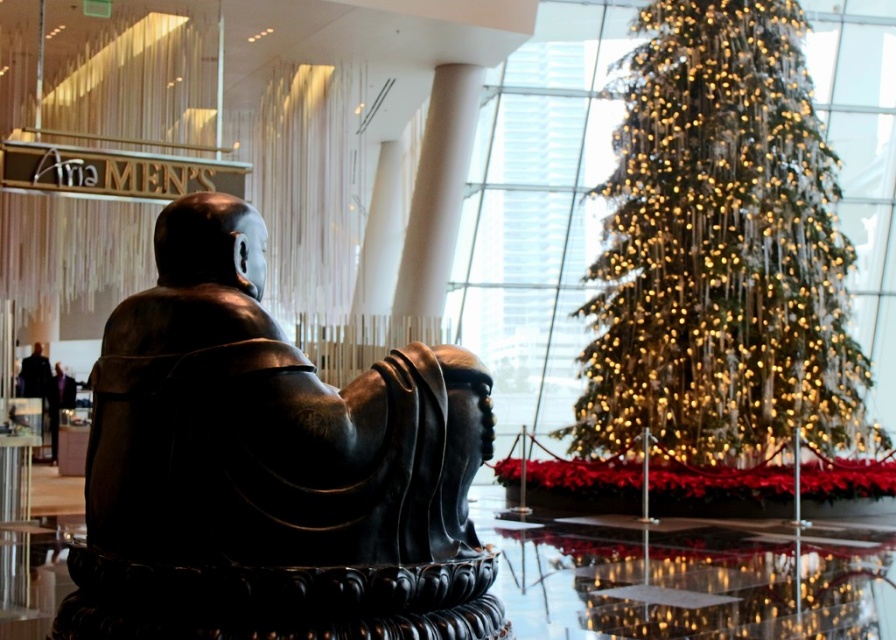
You are an interior designer assessing the layout of the space. Given the bronze statue at left and the iridescent gold lights at center, which object occupies a higher vertical position in the scene?

The iridescent gold lights at center are taller than the bronze statue at left, so the iridescent gold lights at center occupy a higher vertical position in the scene.

You are standing in the shopping mall and want to take a photo of the bronze statue at left. Where should you position yourself to capture it in the frame?

To capture the bronze statue at left in your photo, position yourself so that the statue is centered at the coordinates corresponding to point 2D location at point (270, 468).

You are a maintenance worker in the mall and need to reach the bronze statue at left to clean it. Your ladder is 3 meters long. Can you safely reach the statue with the ladder?

The bronze statue at left is 3.28 meters away from the viewer. Since the ladder is only 3 meters long, it is not long enough to safely reach the statue.